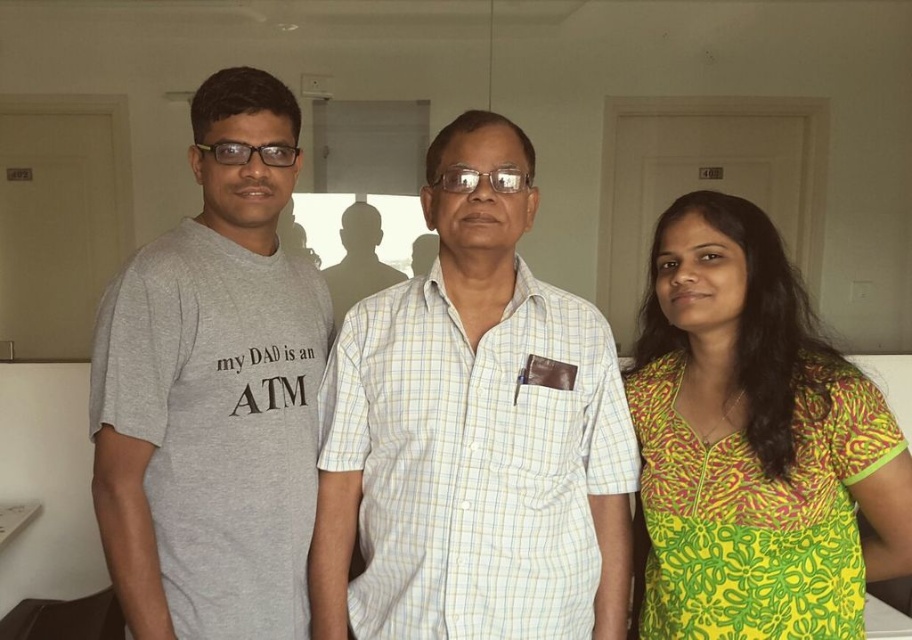
Question: Which point appears farthest from the camera in this image?

Choices:
 (A) (349, 236)
 (B) (628, 497)
 (C) (224, 74)
 (D) (788, 364)

Answer: (A)

Question: Based on their relative distances, which object is nearer to the printed cotton dress at right?

Choices:
 (A) yellow checkered shirt at center
 (B) silhouette of person at center
 (C) gray cotton t-shirt at left

Answer: (A)

Question: Does gray cotton t-shirt at left have a lesser width compared to silhouette of person at center?

Choices:
 (A) yes
 (B) no

Answer: (A)

Question: Does printed cotton dress at right lie behind silhouette of person at center?

Choices:
 (A) yes
 (B) no

Answer: (B)

Question: Where is yellow checkered shirt at center located in relation to silhouette of person at center in the image?

Choices:
 (A) below
 (B) above

Answer: (A)

Question: Which object appears farthest from the camera in this image?

Choices:
 (A) gray cotton t-shirt at left
 (B) printed cotton dress at right
 (C) yellow checkered shirt at center
 (D) silhouette of person at center

Answer: (D)